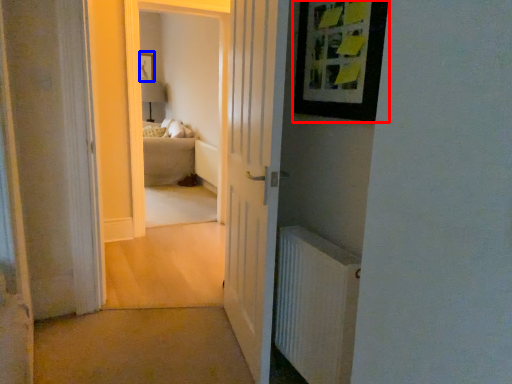
Question: Which point is further to the camera, picture frame (highlighted by a red box) or picture frame (highlighted by a blue box)?

Choices:
 (A) picture frame
 (B) picture frame

Answer: (B)